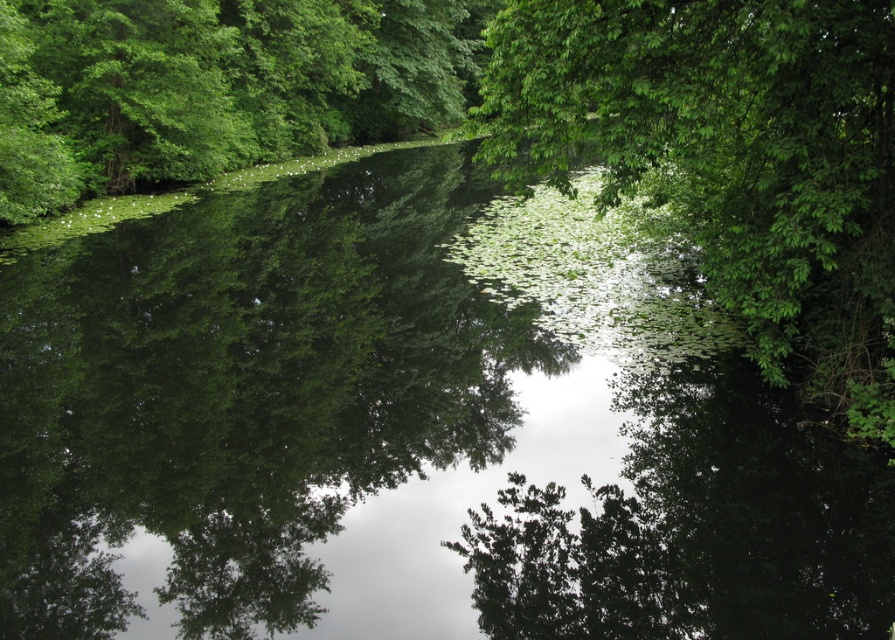
Question: Which point is farther to the camera?

Choices:
 (A) (871, 294)
 (B) (330, 65)

Answer: (B)

Question: Among these objects, which one is farthest from the camera?

Choices:
 (A) green leafy tree at upper center
 (B) green leafy tree at left

Answer: (B)

Question: Is green leafy tree at upper center thinner than green leafy tree at left?

Choices:
 (A) yes
 (B) no

Answer: (A)

Question: Is green leafy tree at upper center positioned in front of green leafy tree at left?

Choices:
 (A) no
 (B) yes

Answer: (B)

Question: Among these points, which one is nearest to the camera?

Choices:
 (A) (159, 19)
 (B) (697, 172)

Answer: (B)

Question: Is green leafy tree at upper center thinner than green leafy tree at left?

Choices:
 (A) yes
 (B) no

Answer: (A)